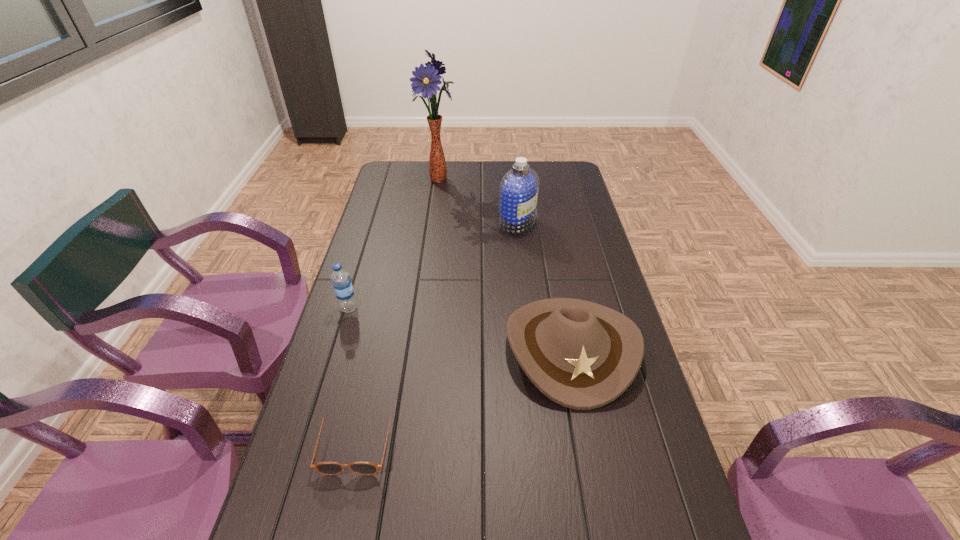
Find the location of a particular element. This screenshot has height=540, width=960. vacant space at the far left corner of the desktop is located at coordinates (391, 166).

At what (x,y) coordinates should I click in order to perform the action: click on free space between the shortest object and the third tallest object. Please return your answer as a coordinate pair (x, y). Looking at the image, I should click on (353, 375).

This screenshot has height=540, width=960. What are the coordinates of `unoccupied position between the leftmost object and the fourth tallest object` in the screenshot? It's located at 460,328.

You are a GUI agent. You are given a task and a screenshot of the screen. Output one action in this format:
    pyautogui.click(x=<x>, y=<y>)
    Task: Click on the vacant point located between the fourth tallest object and the second farthest object
    
    Given the screenshot: What is the action you would take?
    pyautogui.click(x=544, y=285)

At what (x,y) coordinates should I click in order to perform the action: click on free point between the second farthest object and the farthest object. Please return your answer as a coordinate pair (x, y). Looking at the image, I should click on (477, 201).

I want to click on unoccupied position between the shortest object and the flower arrangement, so click(x=397, y=310).

You are a GUI agent. You are given a task and a screenshot of the screen. Output one action in this format:
    pyautogui.click(x=<x>, y=<y>)
    Task: Click on the free space between the tallest object and the third tallest object
    The width and height of the screenshot is (960, 540).
    Given the screenshot: What is the action you would take?
    pyautogui.click(x=394, y=244)

At what (x,y) coordinates should I click in order to perform the action: click on free spot between the fourth tallest object and the cleansing agent. Please return your answer as a coordinate pair (x, y). Looking at the image, I should click on (544, 285).

Where is `empty space that is in between the sunglasses and the tallest object`? This screenshot has width=960, height=540. empty space that is in between the sunglasses and the tallest object is located at coordinates (397, 310).

Locate which object is the second closest to the nearest object. Please provide its 2D coordinates. Your answer should be formatted as a tuple, i.e. [(x, y)], where the tuple contains the x and y coordinates of a point satisfying the conditions above.

[(341, 280)]